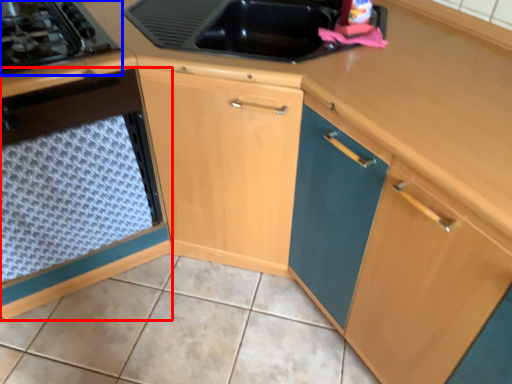
Question: Which object appears farthest to the camera in this image, cabinetry (highlighted by a red box) or gas stove (highlighted by a blue box)?

Choices:
 (A) cabinetry
 (B) gas stove

Answer: (B)